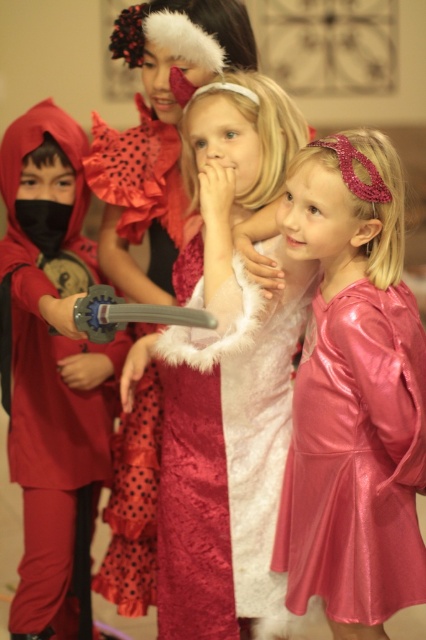
You are a photographer trying to capture a group shot of the matte red costume at left and the shiny pink dress at lower right. To ensure both are in frame, should you adjust your camera to the left or the right?

The matte red costume at left is to the left of the shiny pink dress at lower right, so you should adjust your camera to the left to include both in the frame.

You are a photographer trying to capture a group photo of the shiny pink dress at lower right and the velvet maroon dress at center. Based on their heights, which costume should you position closer to the camera to ensure both are fully visible in the photo?

Since the shiny pink dress at lower right is shorter than the velvet maroon dress at center, you should position the shiny pink dress at lower right closer to the camera to ensure both are fully visible in the photo.

You are a photographer setting up for a group photo. You have two main subjects in the scene, the matte red costume at left and the shiny pink dress at lower right. Based on their sizes, which one should you focus on first to ensure proper framing?

The matte red costume at left is bigger than the shiny pink dress at lower right, so you should focus on the matte red costume at left first to ensure proper framing.